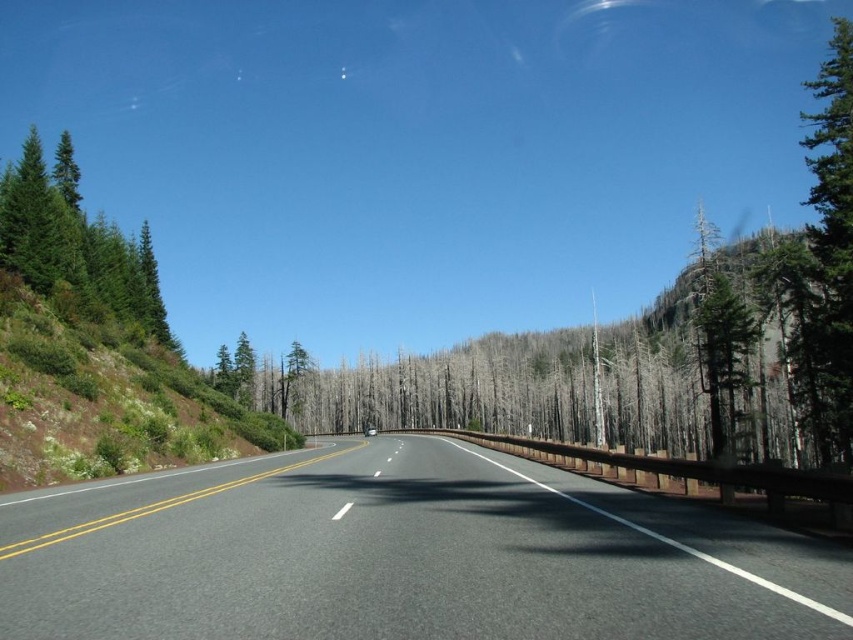
You are a hiker planning to cross the road and head into the forest. You see the green shrubbery at left and the green matte tree at right. Which direction should you choose if you want to find a narrower path through the vegetation?

You should choose the green shrubbery at left because it is thinner than the green matte tree at right, indicating a narrower path through the vegetation there.

You are a hiker planning to cross the road from the forest on the left to the forest on the right. You see a point marked as point (x=106, y=400) indicating green shrubbery at left. Can you safely cross the road at this point without stepping on the road itself?

The point (x=106, y=400) indicating green shrubbery at left is located on the left side of the road, so you can safely cross the road at this point without stepping on the road itself by moving from the green shrubbery at left to the forest on the right side.